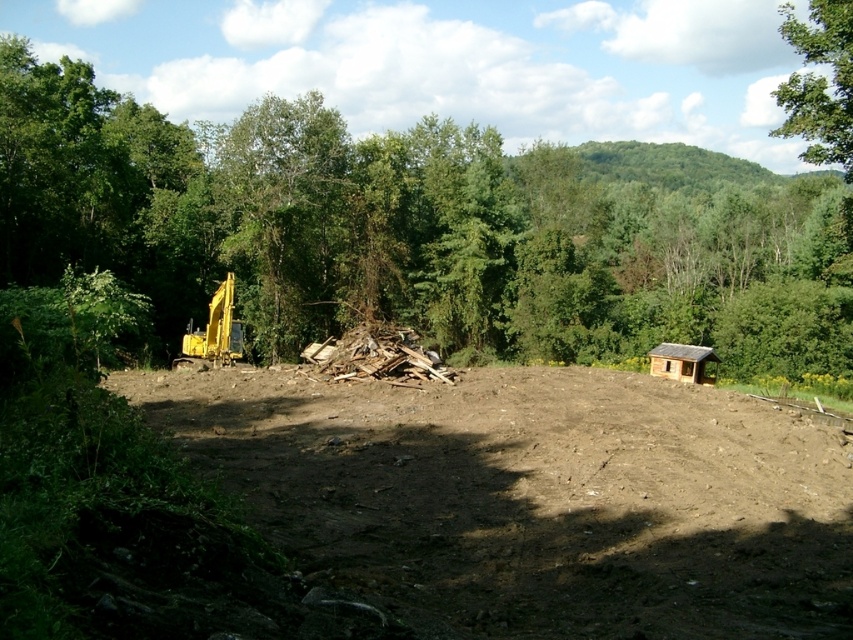
Question: From the image, what is the correct spatial relationship of green leafy tree at center in relation to green leafy tree at upper right?

Choices:
 (A) left
 (B) right

Answer: (A)

Question: Which point appears farthest from the camera in this image?

Choices:
 (A) (225, 307)
 (B) (711, 461)
 (C) (456, 259)
 (D) (694, 349)

Answer: (C)

Question: Does green leafy tree at upper right appear under brown wooden hut at center-right?

Choices:
 (A) yes
 (B) no

Answer: (B)

Question: Can you confirm if green leafy tree at upper right is positioned below yellow rubber excavator at left?

Choices:
 (A) yes
 (B) no

Answer: (B)

Question: Which point is farther to the camera?

Choices:
 (A) yellow rubber excavator at left
 (B) brown dirt field at center
 (C) green leafy tree at upper right

Answer: (A)

Question: Which of the following is the closest to the observer?

Choices:
 (A) yellow rubber excavator at left
 (B) green leafy tree at center
 (C) brown dirt field at center
 (D) brown wooden hut at center-right

Answer: (C)